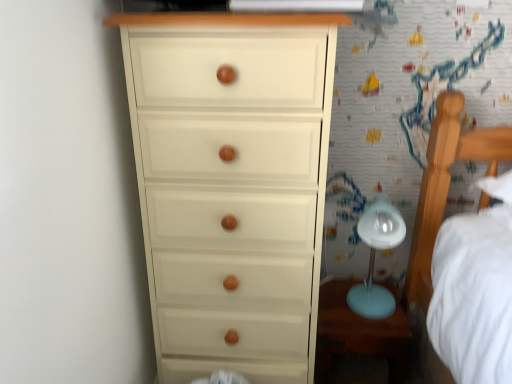
Identify the location of empty space that is ontop of matte blue table at lower right (from a real-world perspective). The height and width of the screenshot is (384, 512). (351, 306).